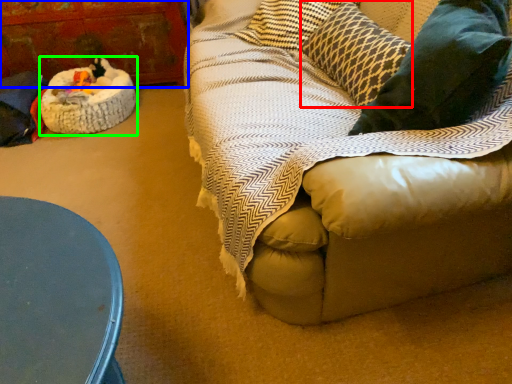
Question: Which object is the farthest from pillow (highlighted by a red box)? Choose among these: armoire (highlighted by a blue box) or cat bed (highlighted by a green box).

Choices:
 (A) armoire
 (B) cat bed

Answer: (A)